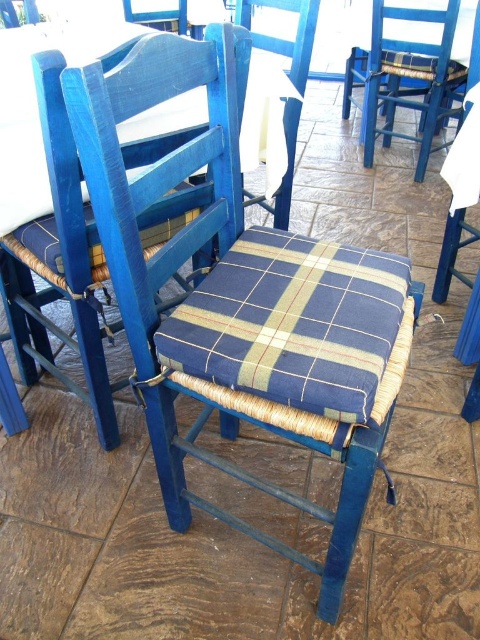
You are standing at the origin point in the room. Where is the matte blue wood chair at center located in coordinates?

The matte blue wood chair at center is located at coordinates point (108, 205).